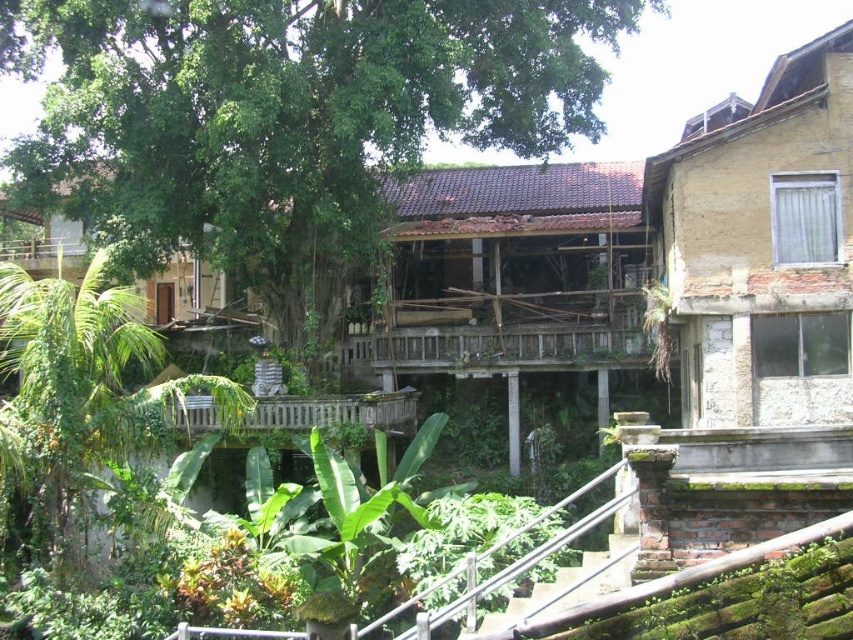
Can you confirm if green leafy tree at center is positioned below green leafy tree at left?

Actually, green leafy tree at center is above green leafy tree at left.

Can you confirm if green leafy tree at center is positioned above green leafy tree at left?

Yes.

Which is behind, point (183, 10) or point (97, 316)?

Positioned behind is point (183, 10).

You are a GUI agent. You are given a task and a screenshot of the screen. Output one action in this format:
    pyautogui.click(x=<x>, y=<y>)
    Task: Click on the green leafy tree at center
    
    Given the screenshot: What is the action you would take?
    pyautogui.click(x=285, y=116)

Is green leafy tree at center thinner than wooden at center?

No, green leafy tree at center is not thinner than wooden at center.

Which is above, green leafy tree at center or wooden at center?

Positioned higher is green leafy tree at center.

Between point (328, 108) and point (329, 404), which one is positioned behind?

The point (329, 404) is more distant.

The width and height of the screenshot is (853, 640). I want to click on green leafy tree at center, so click(285, 116).

Is point (68, 349) positioned behind point (340, 396)?

No, (68, 349) is in front of (340, 396).

Which is below, green leafy tree at left or wooden at center?

green leafy tree at left

What do you see at coordinates (78, 397) in the screenshot? This screenshot has width=853, height=640. I see `green leafy tree at left` at bounding box center [78, 397].

The width and height of the screenshot is (853, 640). Find the location of `green leafy tree at left`. green leafy tree at left is located at coordinates (78, 397).